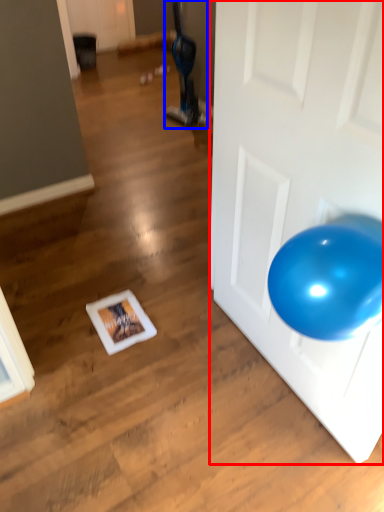
Question: Which object appears closest to the camera in this image, door (highlighted by a red box) or bean bag chair (highlighted by a blue box)?

Choices:
 (A) door
 (B) bean bag chair

Answer: (A)